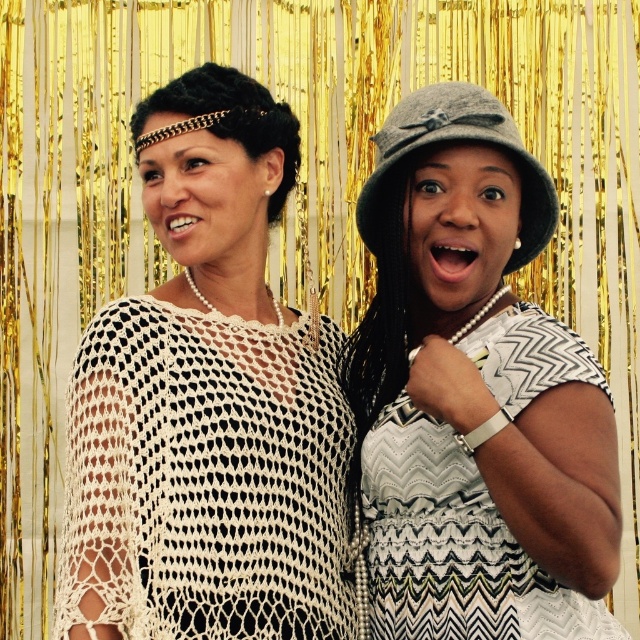
Question: Is white crochet top at center positioned at the back of gray felt hat at center?

Choices:
 (A) no
 (B) yes

Answer: (B)

Question: Is white crochet top at center thinner than gray felt hat at center?

Choices:
 (A) no
 (B) yes

Answer: (A)

Question: Which point is closer to the camera?

Choices:
 (A) gray felt hat at upper center
 (B) gray felt hat at center

Answer: (B)

Question: Which point is farther to the camera?

Choices:
 (A) white crochet top at center
 (B) gray felt hat at center
 (C) gray felt hat at upper center

Answer: (C)

Question: Based on their relative distances, which object is farther from the gray felt hat at center?

Choices:
 (A) gray felt hat at upper center
 (B) white crochet top at center

Answer: (B)

Question: Is white crochet top at center positioned behind gray felt hat at center?

Choices:
 (A) yes
 (B) no

Answer: (A)